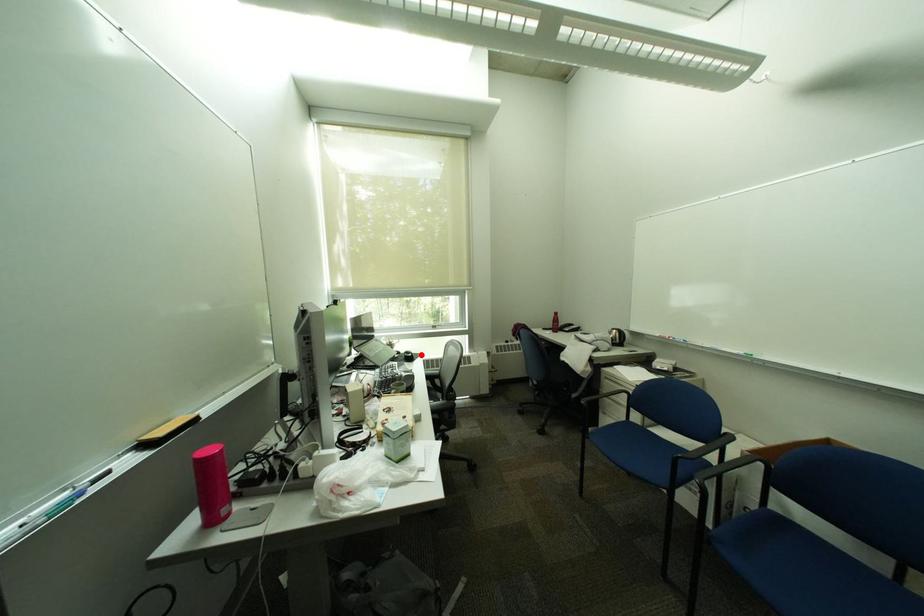
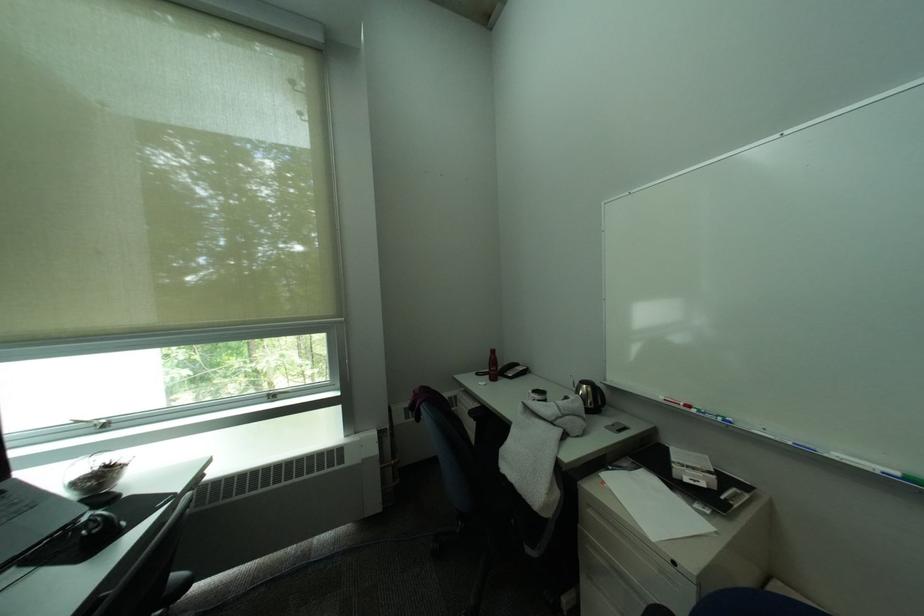
Question: I am providing you with two images of the same scene from different viewpoints. A red point is marked on the first image. At the location where the point appears in image 1, is it still visible in image 2?

Choices:
 (A) Yes
 (B) No

Answer: (A)